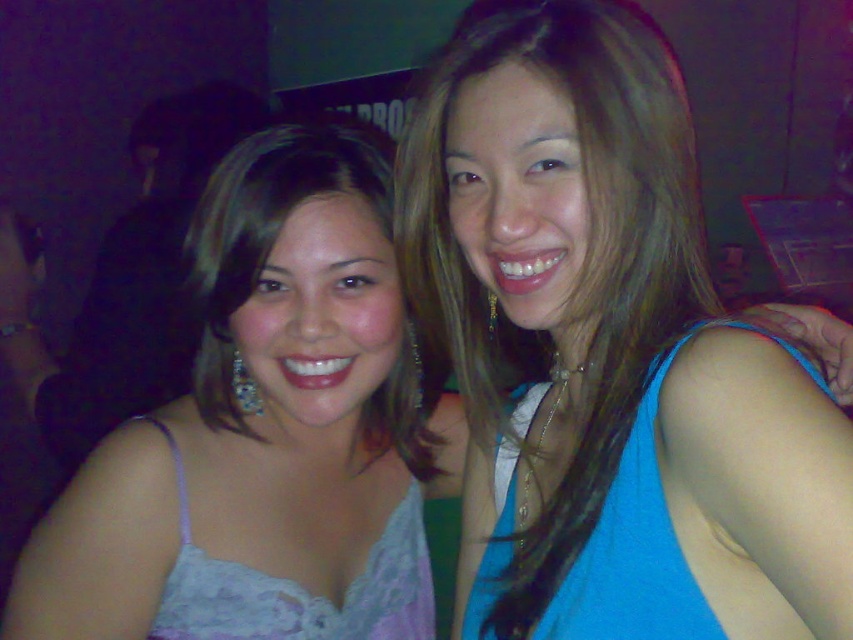
Does point (354, 232) come closer to viewer compared to point (375, 563)?

Yes, point (354, 232) is in front of point (375, 563).

Identify the location of lace fabric dress at center. Image resolution: width=853 pixels, height=640 pixels. (265, 426).

You are a GUI agent. You are given a task and a screenshot of the screen. Output one action in this format:
    pyautogui.click(x=<x>, y=<y>)
    Task: Click on the lace fabric dress at center
    The height and width of the screenshot is (640, 853).
    Given the screenshot: What is the action you would take?
    pyautogui.click(x=265, y=426)

Consider the image. Can you confirm if blue fabric top at upper right is smaller than lace fabric dress at center?

No.

Is point (489, 180) farther from viewer compared to point (209, 524)?

No, it is in front of (209, 524).

Which is in front, point (543, 513) or point (387, 314)?

Positioned in front is point (543, 513).

Where is `blue fabric top at upper right`? blue fabric top at upper right is located at coordinates (610, 353).

Between point (354, 193) and point (593, 616), which one is positioned behind?

The point (354, 193) is behind.

Is lace fabric dress at center taller than blue fabric dress at right?

Correct, lace fabric dress at center is much taller as blue fabric dress at right.

Locate an element on the screen. The image size is (853, 640). lace fabric dress at center is located at coordinates (265, 426).